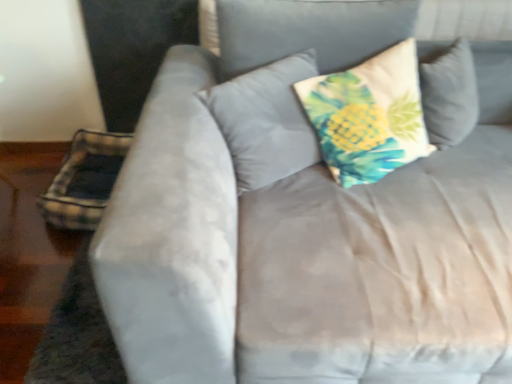
Question: Is point (84, 170) closer or farther from the camera than point (358, 67)?

Choices:
 (A) closer
 (B) farther

Answer: (B)

Question: From the image's perspective, is plaid fabric pillow at lower left, which is counted as the 3th pillow, starting from the right, located above or below printed fabric pillow at center, which is the 1th pillow from right to left?

Choices:
 (A) above
 (B) below

Answer: (B)

Question: Estimate the real-world distances between objects in this image. Which object is closer to the plaid fabric pillow at lower left, the 1th pillow in the left-to-right sequence?

Choices:
 (A) printed fabric pillow at center, which is the 1th pillow from right to left
 (B) printed fabric pillow at center, the second pillow from the right

Answer: (B)

Question: Which of these objects is positioned farthest from the plaid fabric pillow at lower left, the 1th pillow in the left-to-right sequence?

Choices:
 (A) printed fabric pillow at center, the 2th pillow from the left
 (B) printed fabric pillow at center, which ranks as the third pillow in left-to-right order

Answer: (B)